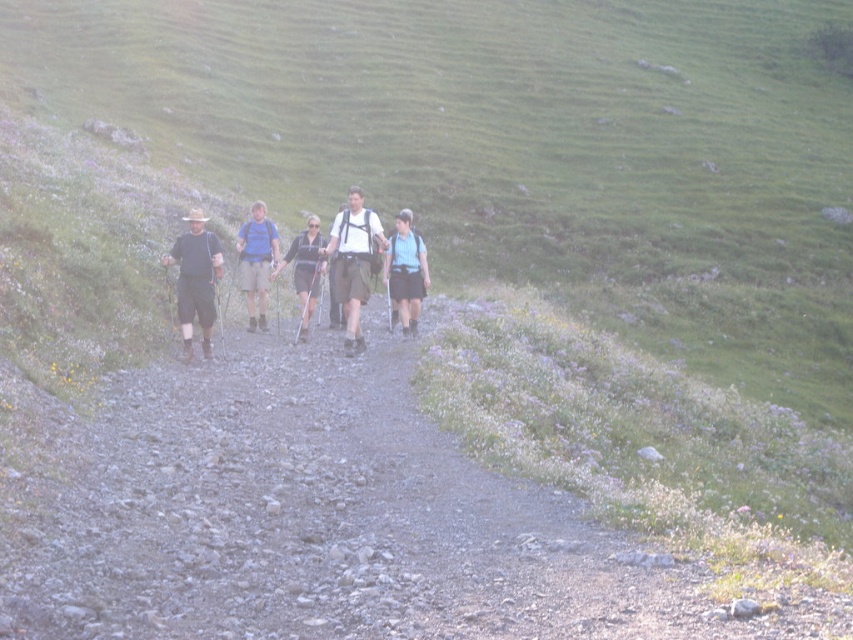
Question: Which object is farther from the camera taking this photo?

Choices:
 (A) matte brown shorts at left
 (B) white fabric backpack at center
 (C) light blue backpack at center
 (D) blue fabric backpack at center

Answer: (C)

Question: Is white fabric backpack at center bigger than matte black jacket at center?

Choices:
 (A) yes
 (B) no

Answer: (A)

Question: Does white fabric backpack at center appear over matte brown shorts at left?

Choices:
 (A) no
 (B) yes

Answer: (A)

Question: Estimate the real-world distances between objects in this image. Which object is farther from the light blue backpack at center?

Choices:
 (A) blue fabric backpack at center
 (B) matte black jacket at center

Answer: (A)

Question: Can you confirm if white fabric backpack at center is positioned above matte black jacket at center?

Choices:
 (A) no
 (B) yes

Answer: (A)

Question: Among these points, which one is farthest from the camera?

Choices:
 (A) (389, 256)
 (B) (262, 241)
 (C) (369, 220)

Answer: (B)